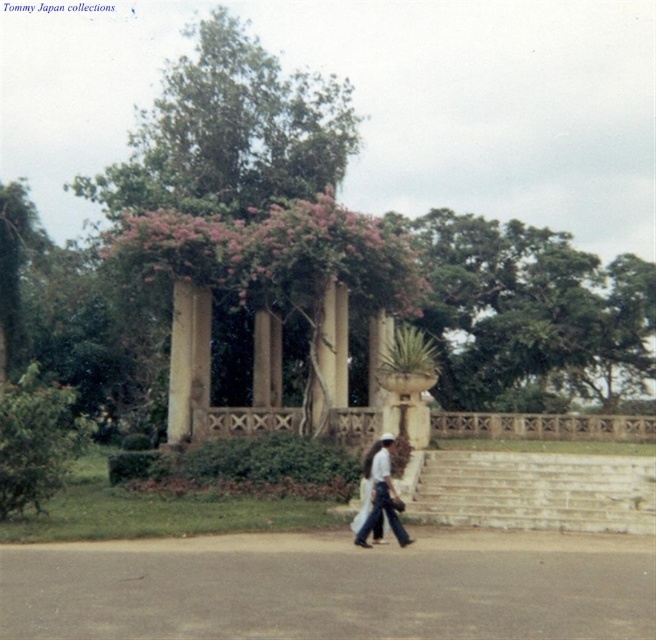
Question: Does green leafy tree at center appear on the left side of denim jeans at center?

Choices:
 (A) yes
 (B) no

Answer: (A)

Question: Does beige stone gazebo at center have a lesser width compared to green leafy tree at center?

Choices:
 (A) no
 (B) yes

Answer: (B)

Question: Which of these objects is positioned closest to the green leafy tree at upper center?

Choices:
 (A) beige stone gazebo at center
 (B) green leafy tree at center
 (C) denim jeans at center
 (D) white cotton shirt at center

Answer: (A)

Question: Estimate the real-world distances between objects in this image. Which object is farther from the green leafy tree at center?

Choices:
 (A) white stone stairs at lower center
 (B) white cotton shirt at center
 (C) denim jeans at center
 (D) green leafy tree at upper center

Answer: (B)

Question: Which is nearer to the white cotton shirt at center?

Choices:
 (A) denim jeans at center
 (B) beige stone gazebo at center
 (C) green leafy tree at center
 (D) white stone stairs at lower center

Answer: (A)

Question: Is green leafy tree at upper center positioned behind white cotton shirt at center?

Choices:
 (A) no
 (B) yes

Answer: (B)